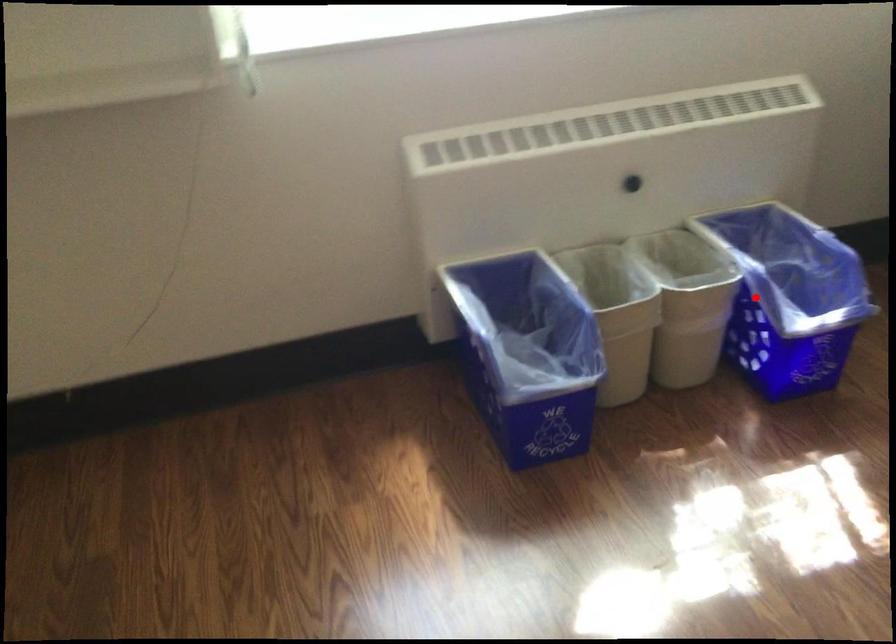
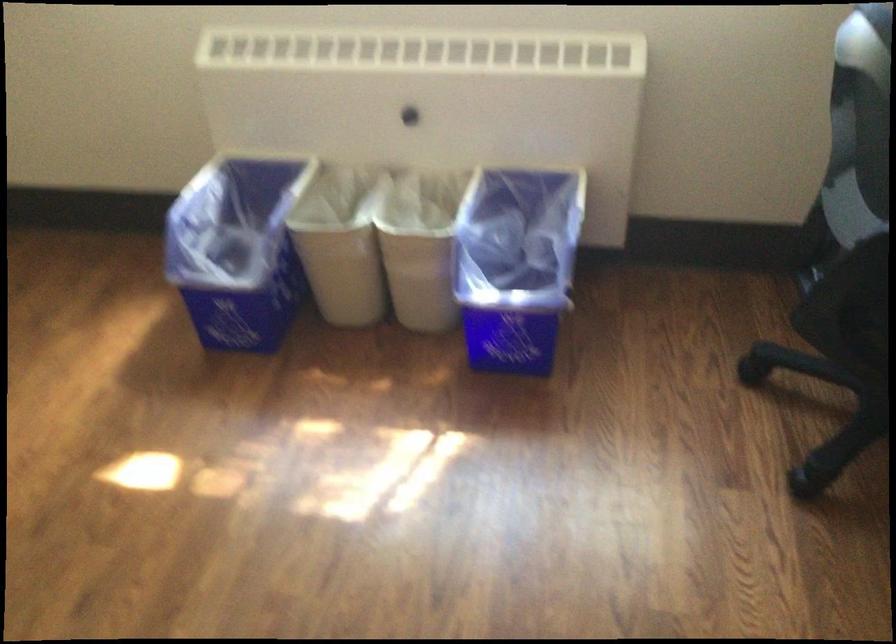
The point at the highlighted location is marked in the first image. Where is the corresponding point in the second image?

(515, 265)